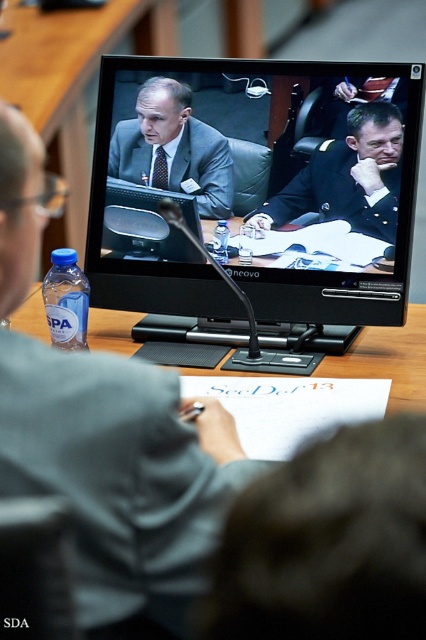
Question: Among these objects, which one is farthest from the camera?

Choices:
 (A) dark blue uniform at center
 (B) matte black monitor at center

Answer: (A)

Question: Which of these objects is positioned farthest from the matte black laptop at left?

Choices:
 (A) matte gray suit at center
 (B) dark gray suit at lower right

Answer: (A)

Question: In this image, where is matte black laptop at left located relative to matte gray suit at center?

Choices:
 (A) below
 (B) above

Answer: (A)

Question: Does matte black laptop at left have a greater width compared to dark blue uniform at center?

Choices:
 (A) yes
 (B) no

Answer: (A)

Question: Estimate the real-world distances between objects in this image. Which object is farther from the matte black laptop at left?

Choices:
 (A) matte black monitor at center
 (B) dark gray suit at lower right
 (C) matte gray suit at center

Answer: (C)

Question: Does matte black monitor at center appear on the left side of matte gray suit at center?

Choices:
 (A) yes
 (B) no

Answer: (B)